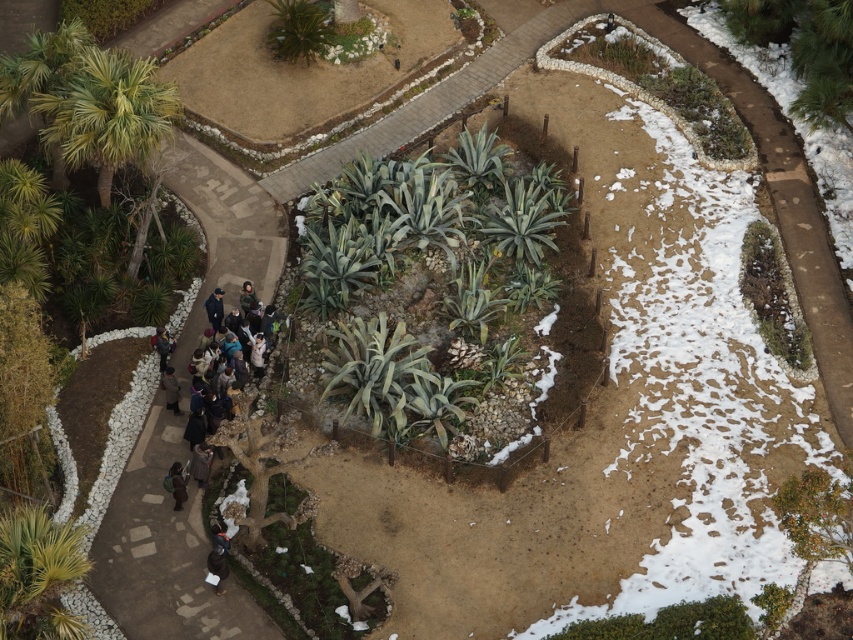
You are standing at the entrance of the botanical garden and see two jackets near the path. Which jacket is closer to the path? The dark brown leather jacket at lower left or the dark gray jacket at lower left?

The dark brown leather jacket at lower left is positioned on the right side of dark gray jacket at lower left. Since the path is bordered by white pebbles on one side and a low fence on the other, the right side of the dark gray jacket at lower left would be closer to the path. Therefore, the dark brown leather jacket at lower left is closer to the path.